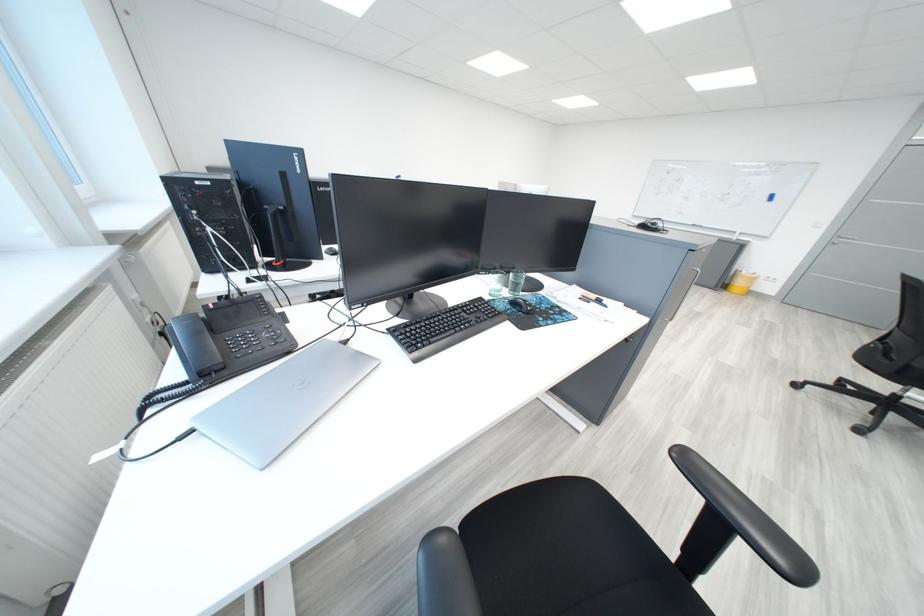
Identify the location of black telephone handset. (193, 346).